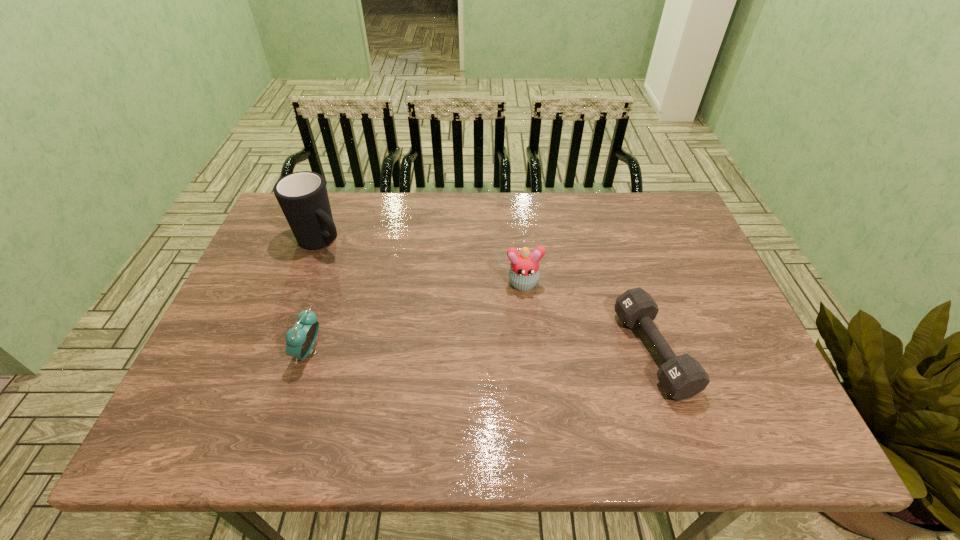
The height and width of the screenshot is (540, 960). I want to click on free location that satisfies the following two spatial constraints: 1. on the front side of the rightmost object; 2. on the left side of the farthest object, so click(280, 352).